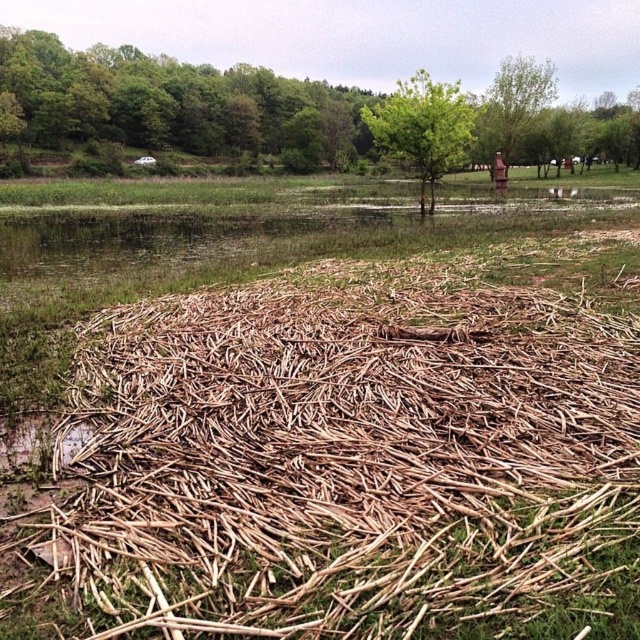
Between point (17, 32) and point (513, 141), which one is positioned in front?

Point (513, 141)

This screenshot has width=640, height=640. Describe the element at coordinates (173, 104) in the screenshot. I see `green leafy tree at upper center` at that location.

You are a GUI agent. You are given a task and a screenshot of the screen. Output one action in this format:
    pyautogui.click(x=<x>, y=<y>)
    Task: Click on the green leafy tree at upper center
    The height and width of the screenshot is (640, 640).
    Given the screenshot: What is the action you would take?
    pyautogui.click(x=173, y=104)

Is brown wood reed at center below green leafy tree at upper center?

Yes.

Who is higher up, brown wood reed at center or green leafy tree at upper center?

green leafy tree at upper center

In order to click on brown wood reed at center in this screenshot , I will do `click(346, 454)`.

The height and width of the screenshot is (640, 640). Find the location of `brown wood reed at center`. brown wood reed at center is located at coordinates (346, 454).

How distant is brown wood reed at center from green leafy tree at center?

brown wood reed at center is 151.73 feet away from green leafy tree at center.

Can you confirm if brown wood reed at center is taller than green leafy tree at center?

No.

Between point (397, 621) and point (426, 128), which one is positioned behind?

Point (426, 128)

Locate an element on the screen. brown wood reed at center is located at coordinates (346, 454).